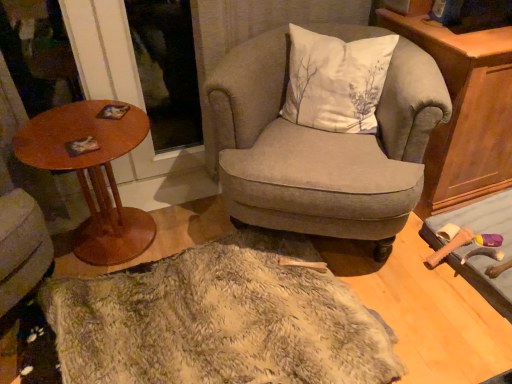
At what (x,y) coordinates should I click in order to perform the action: click on wooden round table at left. Please return your answer as a coordinate pair (x, y). Looking at the image, I should click on (93, 173).

Describe the element at coordinates (93, 173) in the screenshot. I see `wooden round table at left` at that location.

The width and height of the screenshot is (512, 384). I want to click on fuzzy beige rug at center, so click(x=219, y=320).

What do you see at coordinates (464, 109) in the screenshot?
I see `wooden cabinet at right` at bounding box center [464, 109].

You are a GUI agent. You are given a task and a screenshot of the screen. Output one action in this format:
    pyautogui.click(x=<x>, y=<y>)
    Task: Click on the white cotton cushion at center
    
    Given the screenshot: What is the action you would take?
    pyautogui.click(x=336, y=81)

How different are the orientations of textured gray armchair at center and fuzzy beige rug at center in degrees?

They differ by 36.9 degrees in their facing directions.

Can you confirm if textured gray armchair at center is smaller than fuzzy beige rug at center?

No, textured gray armchair at center is not smaller than fuzzy beige rug at center.

Are textured gray armchair at center and fuzzy beige rug at center beside each other?

No, textured gray armchair at center is not in contact with fuzzy beige rug at center.

How distant is textured gray armchair at center from fuzzy beige rug at center?

A distance of 42.41 centimeters exists between textured gray armchair at center and fuzzy beige rug at center.

Which of these two, white cotton cushion at center or wooden cabinet at right, is thinner?

white cotton cushion at center.

From the image's perspective, is white cotton cushion at center below wooden cabinet at right?

Actually, white cotton cushion at center appears above wooden cabinet at right in the image.

Does white cotton cushion at center have a smaller size compared to wooden cabinet at right?

Yes.

Is point (383, 57) more distant than point (458, 113)?

Yes, point (383, 57) is behind point (458, 113).

Is the depth of wooden cabinet at right greater than that of fuzzy beige rug at center?

That is True.

Can you confirm if wooden cabinet at right is shorter than fuzzy beige rug at center?

In fact, wooden cabinet at right may be taller than fuzzy beige rug at center.

In the image, is wooden cabinet at right on the left side or the right side of fuzzy beige rug at center?

In the image, wooden cabinet at right appears on the right side of fuzzy beige rug at center.

Does textured gray armchair at center appear on the left side of wooden cabinet at right?

Indeed, textured gray armchair at center is positioned on the left side of wooden cabinet at right.

In terms of size, does textured gray armchair at center appear bigger or smaller than wooden cabinet at right?

Clearly, textured gray armchair at center is larger in size than wooden cabinet at right.

From their relative heights in the image, would you say textured gray armchair at center is taller or shorter than wooden cabinet at right?

textured gray armchair at center is shorter than wooden cabinet at right.

From the image's perspective, which one is positioned lower, textured gray armchair at center or wooden cabinet at right?

textured gray armchair at center, from the image's perspective.

I want to click on blanket to the left of wooden cabinet at right, so click(219, 320).

Is fuzzy beige rug at center not within wooden cabinet at right?

fuzzy beige rug at center lies outside wooden cabinet at right's area.

Does fuzzy beige rug at center lie in front of wooden cabinet at right?

That is True.

Is fuzzy beige rug at center far away from wooden cabinet at right?

No, there isn't a large distance between fuzzy beige rug at center and wooden cabinet at right.

From a real-world perspective, does wooden round table at left stand above textured gray armchair at center?

No, from a real-world perspective, wooden round table at left is not over textured gray armchair at center

In the scene shown: Is wooden round table at left in contact with textured gray armchair at center?

No, wooden round table at left is not with textured gray armchair at center.

Which of these two, wooden round table at left or textured gray armchair at center, is smaller?

With smaller size is wooden round table at left.

Would you say wooden round table at left is to the left or to the right of textured gray armchair at center in the picture?

In the image, wooden round table at left appears on the left side of textured gray armchair at center.

Based on the photo, considering the sizes of objects wooden round table at left and wooden cabinet at right in the image provided, who is taller, wooden round table at left or wooden cabinet at right?

wooden cabinet at right.

Would you consider wooden round table at left to be distant from wooden cabinet at right?

wooden round table at left is positioned a significant distance from wooden cabinet at right.

The height and width of the screenshot is (384, 512). I want to click on table on the left of wooden cabinet at right, so click(93, 173).

How many degrees apart are the facing directions of wooden round table at left and wooden cabinet at right?

The angle between the facing direction of wooden round table at left and the facing direction of wooden cabinet at right is 93.7 degrees.

You are a GUI agent. You are given a task and a screenshot of the screen. Output one action in this format:
    pyautogui.click(x=<x>, y=<y>)
    Task: Click on the chair above the fuzzy beige rug at center (from the image's perspective)
    The image size is (512, 384).
    Given the screenshot: What is the action you would take?
    pyautogui.click(x=322, y=147)

This screenshot has height=384, width=512. I want to click on pillow that is above the wooden cabinet at right (from a real-world perspective), so click(336, 81).

From the image, which object appears to be farther from wooden round table at left, white cotton cushion at center or wooden cabinet at right?

Among the two, wooden cabinet at right is located further to wooden round table at left.

When comparing their distances from wooden cabinet at right, does white cotton cushion at center or textured gray armchair at center seem further?

textured gray armchair at center lies further to wooden cabinet at right than the other object.

Based on the photo, from the image, which object appears to be farther from wooden round table at left, fuzzy beige rug at center or textured gray armchair at center?

textured gray armchair at center.

Which object lies further to the anchor point fuzzy beige rug at center, textured gray armchair at center or white cotton cushion at center?

white cotton cushion at center.

Estimate the real-world distances between objects in this image. Which object is further from wooden round table at left, textured gray armchair at center or fuzzy beige rug at center?

textured gray armchair at center.

Estimate the real-world distances between objects in this image. Which object is further from textured gray armchair at center, wooden round table at left or fuzzy beige rug at center?

wooden round table at left.

Looking at the image, which one is located closer to white cotton cushion at center, wooden round table at left or wooden cabinet at right?

Among the two, wooden cabinet at right is located nearer to white cotton cushion at center.

Which object lies nearer to the anchor point wooden cabinet at right, white cotton cushion at center or wooden round table at left?

white cotton cushion at center is closer to wooden cabinet at right.

Image resolution: width=512 pixels, height=384 pixels. Identify the location of blanket between wooden round table at left and wooden cabinet at right from left to right. (219, 320).

Locate an element on the screen. The image size is (512, 384). blanket located between wooden round table at left and textured gray armchair at center in the left-right direction is located at coordinates (219, 320).

This screenshot has height=384, width=512. In order to click on pillow between textured gray armchair at center and wooden cabinet at right in this screenshot , I will do `click(336, 81)`.

Locate an element on the screen. The height and width of the screenshot is (384, 512). chair between white cotton cushion at center and fuzzy beige rug at center in the vertical direction is located at coordinates (322, 147).